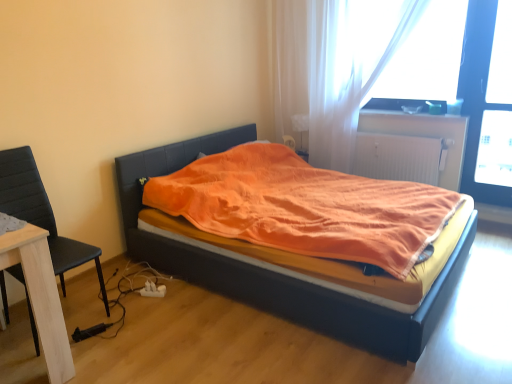
At what (x,y) coordinates should I click in order to perform the action: click on vacant area that lies to the right of black leather chair at left. Please return your answer as a coordinate pair (x, y). The height and width of the screenshot is (384, 512). Looking at the image, I should click on (136, 331).